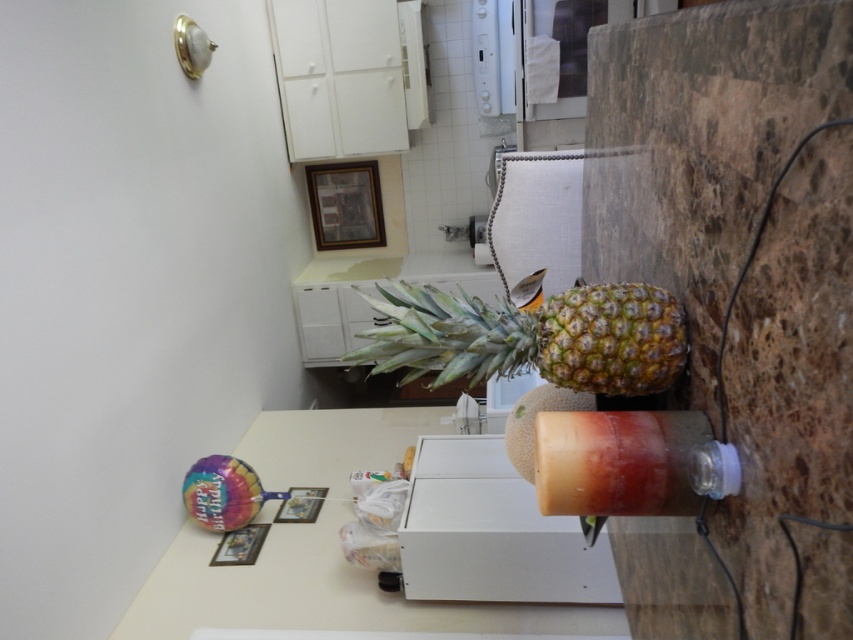
Question: Does white matte table at center appear on the right side of yellow-green textured pineapple at center?

Choices:
 (A) yes
 (B) no

Answer: (B)

Question: Does white matte table at center have a lesser width compared to yellow-green textured pineapple at center?

Choices:
 (A) yes
 (B) no

Answer: (B)

Question: Which point is farther from the camera taking this photo?

Choices:
 (A) (381, 451)
 (B) (634, 451)
 (C) (595, 317)

Answer: (A)

Question: Can you confirm if white matte table at center is smaller than translucent plastic bottle at lower right?

Choices:
 (A) no
 (B) yes

Answer: (A)

Question: Which point is closer to the camera taking this photo?

Choices:
 (A) (544, 369)
 (B) (622, 634)
 (C) (540, 477)

Answer: (C)

Question: Which is nearer to the yellow-green textured pineapple at center?

Choices:
 (A) translucent plastic bottle at lower right
 (B) white matte table at center

Answer: (A)